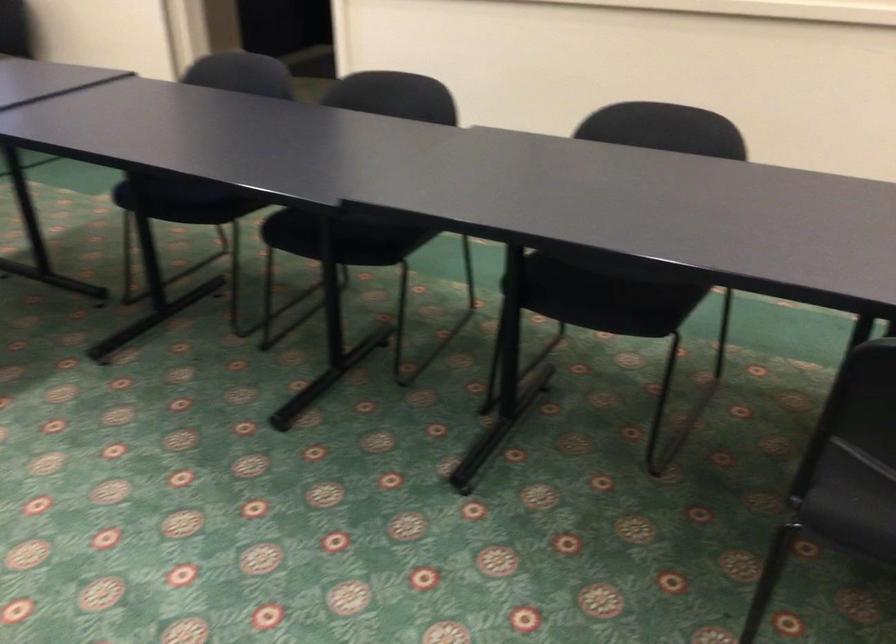
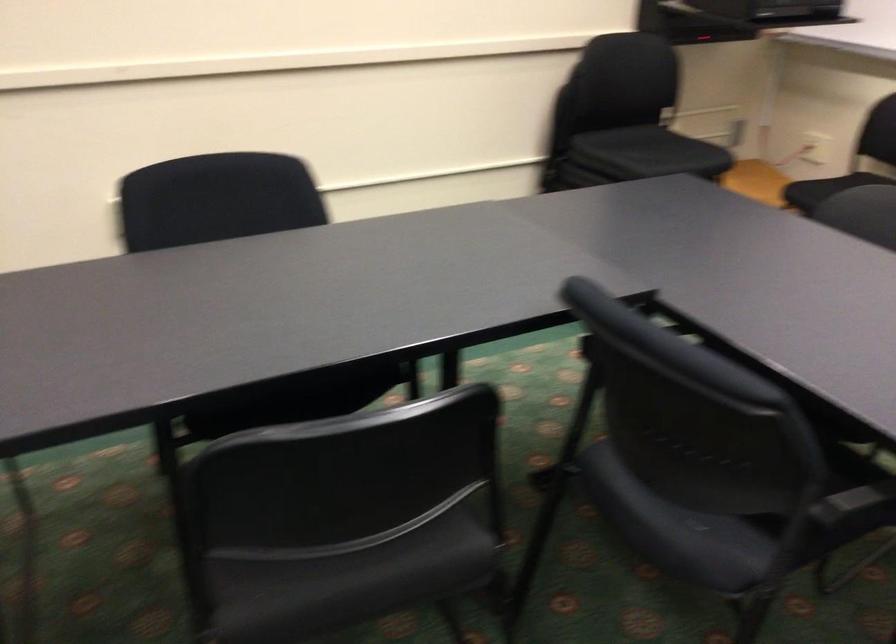
Question: Based on the continuous images, in which direction is the camera rotating? Reply with the corresponding letter.

Choices:
 (A) Left
 (B) Right
 (C) Up
 (D) Down

Answer: (B)